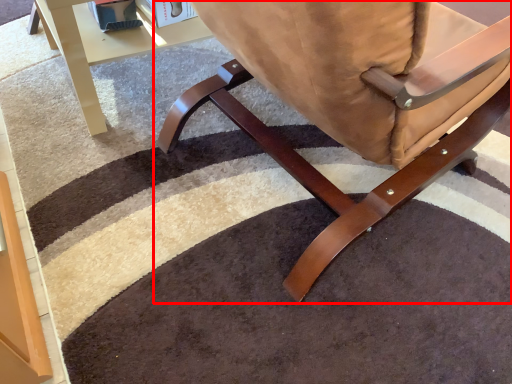
Question: Where is chair (annotated by the red box) located in relation to table in the image?

Choices:
 (A) left
 (B) right

Answer: (B)